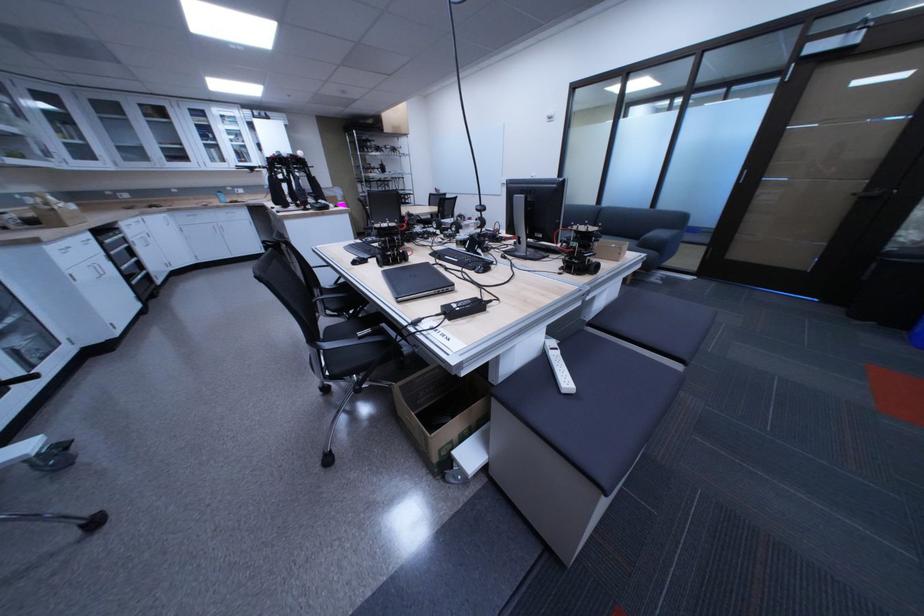
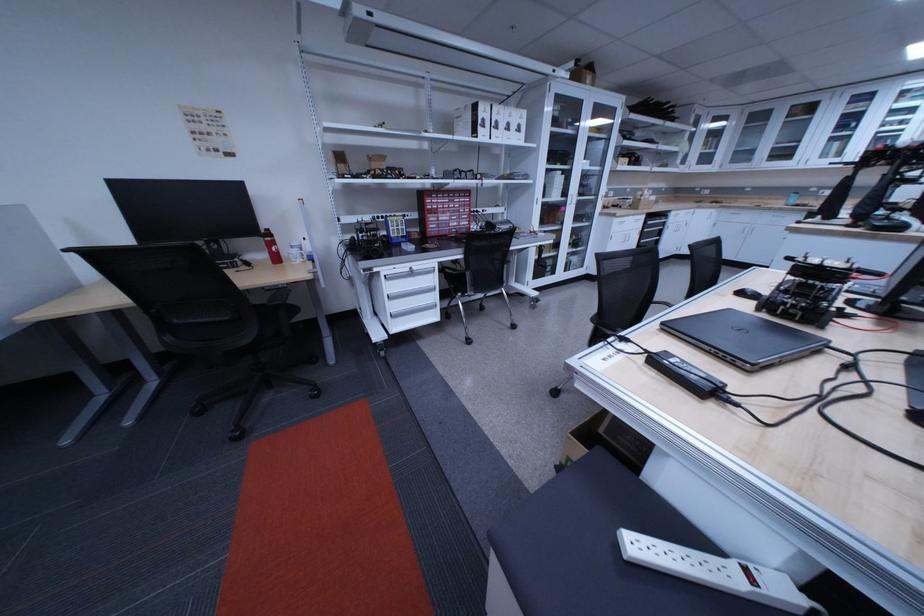
In the second image, find the point that corresponds to point 179,217 in the first image.

(728, 212)